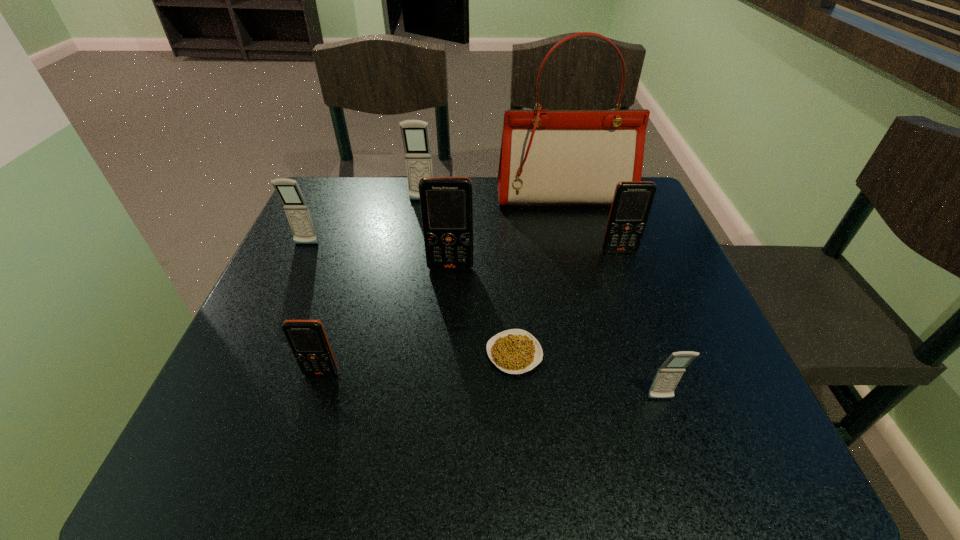
The width and height of the screenshot is (960, 540). I want to click on pink handbag, so click(548, 157).

Where is `the tallest object`? This screenshot has width=960, height=540. the tallest object is located at coordinates (548, 157).

Identify the location of the farthest cellular telephone. The width and height of the screenshot is (960, 540). (415, 134).

Identify the location of the farthest gray cellular telephone. This screenshot has height=540, width=960. (415, 134).

You are a GUI agent. You are given a task and a screenshot of the screen. Output one action in this format:
    pyautogui.click(x=<x>, y=<y>)
    Task: Click on the third cellular telephone from right to left
    
    Given the screenshot: What is the action you would take?
    [446, 203]

Find the location of a particular element. The height and width of the screenshot is (540, 960). the second nearest orange cellular telephone is located at coordinates (446, 203).

You are a GUI agent. You are given a task and a screenshot of the screen. Output one action in this format:
    pyautogui.click(x=<x>, y=<y>)
    Task: Click on the sixth nearest object
    The width and height of the screenshot is (960, 540).
    Given the screenshot: What is the action you would take?
    pyautogui.click(x=297, y=211)

Locate an element on the screen. The image size is (960, 540). the leftmost gray cellular telephone is located at coordinates (297, 211).

This screenshot has height=540, width=960. In order to click on the fourth farthest object in this screenshot , I will do `click(632, 201)`.

You are a GUI agent. You are given a task and a screenshot of the screen. Output one action in this format:
    pyautogui.click(x=<x>, y=<y>)
    Task: Click on the farthest orange cellular telephone
    The height and width of the screenshot is (540, 960).
    Given the screenshot: What is the action you would take?
    pyautogui.click(x=632, y=201)